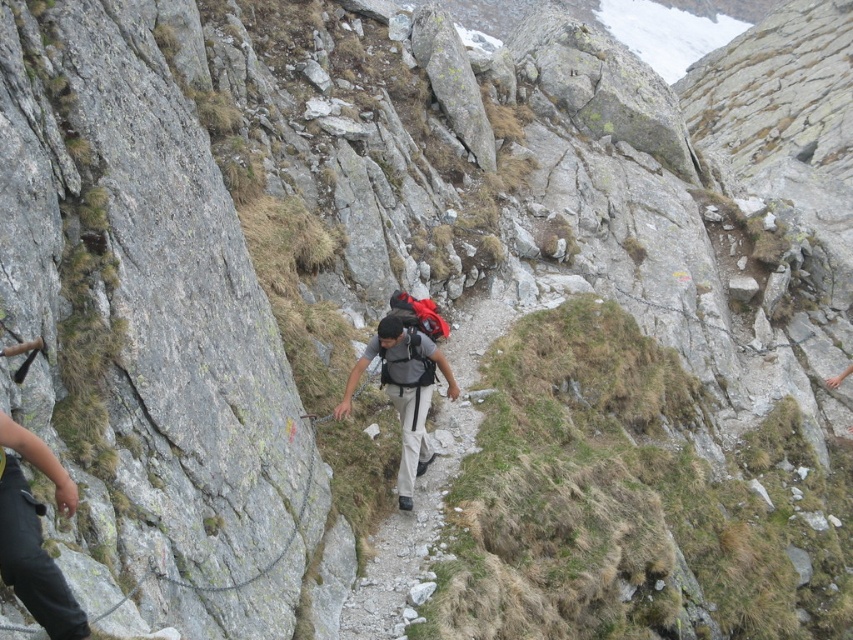
You are a hiker planning to traverse the rugged mountain trail shown in the image. You notice the green grassy slope at center and the matte gray backpack at center. Which of these two objects occupies a bigger area in the scene?

The green grassy slope at center has a larger size compared to the matte gray backpack at center, so the green grassy slope at center occupies a bigger area in the scene.

You are a hiker planning to climb the mountain trail. You see a point marked at coordinates (625, 499). What is the terrain like at that location?

The point at (625, 499) corresponds to a green grassy slope at center, which is part of the mountain trail.

You are a hiker trying to locate the green grassy slope at center on a rugged mountain trail. Based on the coordinates provided, where would you find it?

The green grassy slope at center is located at coordinates point (x=625, y=499).